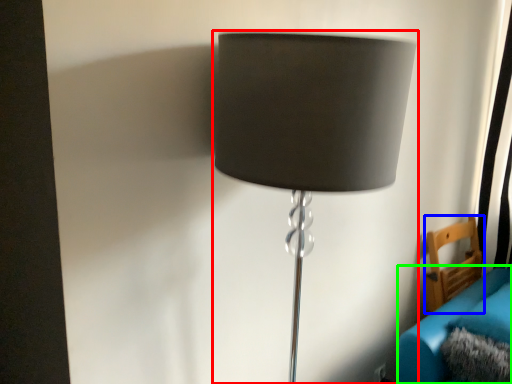
Question: Which object is positioned closest to lamp (highlighted by a red box)? Select from furniture (highlighted by a blue box) and couch (highlighted by a green box).

Choices:
 (A) furniture
 (B) couch

Answer: (B)